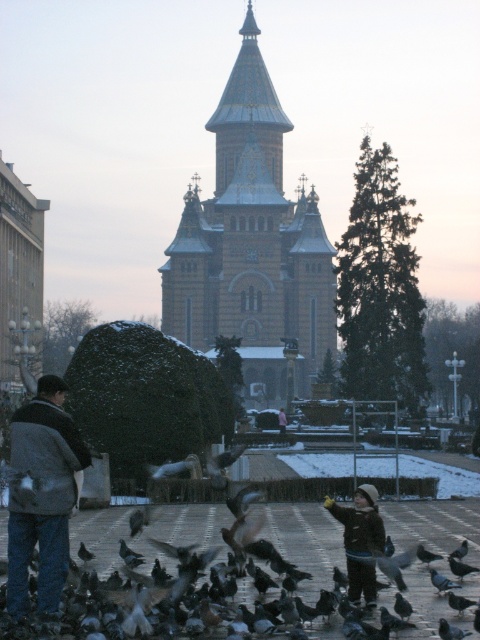
You are a tourist visiting the church and want to take a photo of the golden stone tower at center while also including the dark gray jacket at lower left in the frame. Based on their sizes, will you need to zoom in or zoom out to capture both in the same photo?

The golden stone tower at center is larger than the dark gray jacket at lower left, so you will need to zoom out to capture both in the same photo.

You are a photographer trying to capture a wide shot of the golden stone tower at center and the dark gray jacket at lower left in the same frame. Based on their sizes, which object should you focus on first to ensure both are in the frame?

The golden stone tower at center is wider than the dark gray jacket at lower left, so you should focus on the golden stone tower at center first to ensure both fit in the frame.

You are a photographer trying to capture a closeup of the dark brown winter coat at lower center. Based on the scene description, where should you position your camera to get the best shot?

The dark brown winter coat at lower center is located at point (360, 540), so you should position your camera at that coordinate to capture the best closeup.